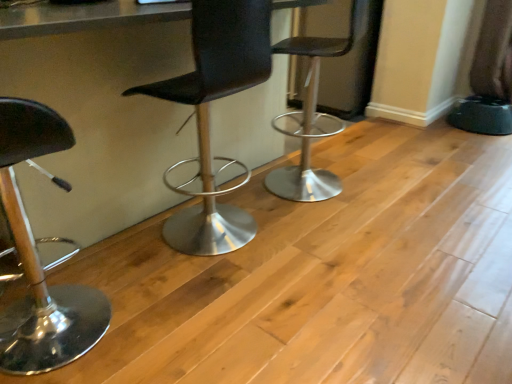
This screenshot has height=384, width=512. Identify the location of shiny black stool at left, the third chair positioned from the right. (39, 259).

Where is `black leather stool at center, which is counted as the 1th chair, starting from the right`? This screenshot has height=384, width=512. black leather stool at center, which is counted as the 1th chair, starting from the right is located at coordinates (313, 114).

You are a GUI agent. You are given a task and a screenshot of the screen. Output one action in this format:
    pyautogui.click(x=<x>, y=<y>)
    Task: Click on the shiny black stool at left, the third chair positioned from the right
    This screenshot has height=384, width=512.
    Given the screenshot: What is the action you would take?
    pyautogui.click(x=39, y=259)

From the image's perspective, would you say black leather stool at center, the third chair viewed from the left, is positioned over metallic gray table at center?

Yes, from the image's perspective, black leather stool at center, the third chair viewed from the left, is over metallic gray table at center.

Which object is closer to the camera taking this photo, black leather stool at center, the third chair viewed from the left, or metallic gray table at center?

metallic gray table at center is in front.

Is black leather stool at center, the third chair viewed from the left, smaller than metallic gray table at center?

Yes.

Is black leather stool at center, which is counted as the 1th chair, starting from the right, at the left side of metallic gray table at center?

Incorrect, black leather stool at center, which is counted as the 1th chair, starting from the right, is not on the left side of metallic gray table at center.

Considering the sizes of objects black leather stool at center, the third chair viewed from the left, and black leather chair at center, which is the 2th chair in left-to-right order, in the image provided, who is thinner, black leather stool at center, the third chair viewed from the left, or black leather chair at center, which is the 2th chair in left-to-right order,?

With smaller width is black leather chair at center, which is the 2th chair in left-to-right order.

Is black leather stool at center, which is counted as the 1th chair, starting from the right, turned away from black leather chair at center, positioned as the second chair in right-to-left order?

That's not correct — black leather stool at center, which is counted as the 1th chair, starting from the right, is not looking away from black leather chair at center, positioned as the second chair in right-to-left order.

Considering the relative positions of black leather stool at center, which is counted as the 1th chair, starting from the right, and black leather chair at center, which is the 2th chair in left-to-right order, in the image provided, is black leather stool at center, which is counted as the 1th chair, starting from the right, to the left of black leather chair at center, which is the 2th chair in left-to-right order, from the viewer's perspective?

No, black leather stool at center, which is counted as the 1th chair, starting from the right, is not to the left of black leather chair at center, which is the 2th chair in left-to-right order.

Based on the photo, does black leather chair at center, which is the 2th chair in left-to-right order, come in front of metallic gray table at center?

No, it is not.

You are a GUI agent. You are given a task and a screenshot of the screen. Output one action in this format:
    pyautogui.click(x=<x>, y=<y>)
    Task: Click on the table in front of the black leather chair at center, which is the 2th chair in left-to-right order
    
    Given the screenshot: What is the action you would take?
    pyautogui.click(x=221, y=65)

Considering the relative positions of black leather chair at center, positioned as the second chair in right-to-left order, and metallic gray table at center in the image provided, is black leather chair at center, positioned as the second chair in right-to-left order, to the left or to the right of metallic gray table at center?

A: From the image, it's evident that black leather chair at center, positioned as the second chair in right-to-left order, is to the right of metallic gray table at center.

At what (x,y) coordinates should I click in order to perform the action: click on chair that is the 2nd object above the shiny black stool at left, the 1th chair positioned from the left (from a real-world perspective). Please return your answer as a coordinate pair (x, y). Looking at the image, I should click on (209, 115).

Considering the sizes of shiny black stool at left, the 1th chair positioned from the left, and black leather chair at center, positioned as the second chair in right-to-left order, in the image, is shiny black stool at left, the 1th chair positioned from the left, taller or shorter than black leather chair at center, positioned as the second chair in right-to-left order,?

Considering their sizes, shiny black stool at left, the 1th chair positioned from the left, has less height than black leather chair at center, positioned as the second chair in right-to-left order.

Is shiny black stool at left, the 1th chair positioned from the left, further to camera compared to black leather chair at center, which is the 2th chair in left-to-right order?

No.

Considering the sizes of objects shiny black stool at left, the 1th chair positioned from the left, and black leather chair at center, which is the 2th chair in left-to-right order, in the image provided, who is wider, shiny black stool at left, the 1th chair positioned from the left, or black leather chair at center, which is the 2th chair in left-to-right order,?

Wider between the two is black leather chair at center, which is the 2th chair in left-to-right order.

From a real-world perspective, which object stands above the other?

metallic gray table at center is physically above.

Image resolution: width=512 pixels, height=384 pixels. I want to click on table lying on the right of shiny black stool at left, the third chair positioned from the right, so click(221, 65).

Between shiny black stool at left, the third chair positioned from the right, and metallic gray table at center, which one appears on the right side from the viewer's perspective?

Positioned to the right is metallic gray table at center.

Could you tell me if metallic gray table at center is turned towards black leather chair at center, positioned as the second chair in right-to-left order?

Yes, metallic gray table at center is oriented towards black leather chair at center, positioned as the second chair in right-to-left order.

Who is taller, metallic gray table at center or black leather chair at center, which is the 2th chair in left-to-right order?

With more height is metallic gray table at center.

Between metallic gray table at center and black leather chair at center, which is the 2th chair in left-to-right order, which one has larger width?

Wider between the two is metallic gray table at center.

Based on the photo, considering the relative sizes of black leather chair at center, positioned as the second chair in right-to-left order, and shiny black stool at left, the third chair positioned from the right, in the image provided, is black leather chair at center, positioned as the second chair in right-to-left order, taller than shiny black stool at left, the third chair positioned from the right,?

Yes.

Can you tell me how much black leather chair at center, positioned as the second chair in right-to-left order, and shiny black stool at left, the third chair positioned from the right, differ in facing direction?

The angle between the facing direction of black leather chair at center, positioned as the second chair in right-to-left order, and the facing direction of shiny black stool at left, the third chair positioned from the right, is 6.21 degrees.

From a real-world perspective, who is located higher, black leather chair at center, positioned as the second chair in right-to-left order, or shiny black stool at left, the 1th chair positioned from the left?

In real-world perspective, black leather chair at center, positioned as the second chair in right-to-left order, is above.

Which object is closer to the camera taking this photo, black leather chair at center, positioned as the second chair in right-to-left order, or shiny black stool at left, the 1th chair positioned from the left?

shiny black stool at left, the 1th chair positioned from the left, is in front.

The image size is (512, 384). In order to click on table below the black leather stool at center, the third chair viewed from the left (from the image's perspective) in this screenshot , I will do `click(221, 65)`.

This screenshot has height=384, width=512. In order to click on chair that appears behind the black leather chair at center, which is the 2th chair in left-to-right order in this screenshot , I will do point(313,114).

Based on the photo, when comparing their distances from metallic gray table at center, does black leather stool at center, the third chair viewed from the left, or shiny black stool at left, the 1th chair positioned from the left, seem further?

Based on the image, black leather stool at center, the third chair viewed from the left, appears to be further to metallic gray table at center.

When comparing their distances from shiny black stool at left, the third chair positioned from the right, does black leather chair at center, positioned as the second chair in right-to-left order, or black leather stool at center, the third chair viewed from the left, seem closer?

Among the two, black leather chair at center, positioned as the second chair in right-to-left order, is located nearer to shiny black stool at left, the third chair positioned from the right.

Looking at the image, which one is located further to metallic gray table at center, shiny black stool at left, the 1th chair positioned from the left, or black leather stool at center, which is counted as the 1th chair, starting from the right?

black leather stool at center, which is counted as the 1th chair, starting from the right, lies further to metallic gray table at center than the other object.

Based on their spatial positions, is metallic gray table at center or shiny black stool at left, the third chair positioned from the right, closer to black leather chair at center, positioned as the second chair in right-to-left order?

metallic gray table at center is closer to black leather chair at center, positioned as the second chair in right-to-left order.

Which object lies further to the anchor point black leather chair at center, which is the 2th chair in left-to-right order, black leather stool at center, which is counted as the 1th chair, starting from the right, or metallic gray table at center?

black leather stool at center, which is counted as the 1th chair, starting from the right, is positioned further to the anchor black leather chair at center, which is the 2th chair in left-to-right order.

When comparing their distances from black leather stool at center, the third chair viewed from the left, does black leather chair at center, which is the 2th chair in left-to-right order, or metallic gray table at center seem further?

metallic gray table at center lies further to black leather stool at center, the third chair viewed from the left, than the other object.

Looking at this image, looking at the image, which one is located closer to shiny black stool at left, the third chair positioned from the right, metallic gray table at center or black leather chair at center, positioned as the second chair in right-to-left order?

Among the two, metallic gray table at center is located nearer to shiny black stool at left, the third chair positioned from the right.

When comparing their distances from shiny black stool at left, the third chair positioned from the right, does metallic gray table at center or black leather stool at center, the third chair viewed from the left, seem closer?

metallic gray table at center is closer to shiny black stool at left, the third chair positioned from the right.

Where is `chair between metallic gray table at center and black leather stool at center, which is counted as the 1th chair, starting from the right`? Image resolution: width=512 pixels, height=384 pixels. chair between metallic gray table at center and black leather stool at center, which is counted as the 1th chair, starting from the right is located at coordinates (209, 115).

Where is `chair between metallic gray table at center and shiny black stool at left, the third chair positioned from the right, in the up-down direction`? chair between metallic gray table at center and shiny black stool at left, the third chair positioned from the right, in the up-down direction is located at coordinates (x=209, y=115).

You are a GUI agent. You are given a task and a screenshot of the screen. Output one action in this format:
    pyautogui.click(x=<x>, y=<y>)
    Task: Click on the table between shiny black stool at left, the 1th chair positioned from the left, and black leather stool at center, the third chair viewed from the left, in the horizontal direction
    The height and width of the screenshot is (384, 512).
    Given the screenshot: What is the action you would take?
    pyautogui.click(x=221, y=65)

This screenshot has height=384, width=512. Identify the location of chair located between shiny black stool at left, the third chair positioned from the right, and black leather stool at center, the third chair viewed from the left, in the left-right direction. coord(209,115).